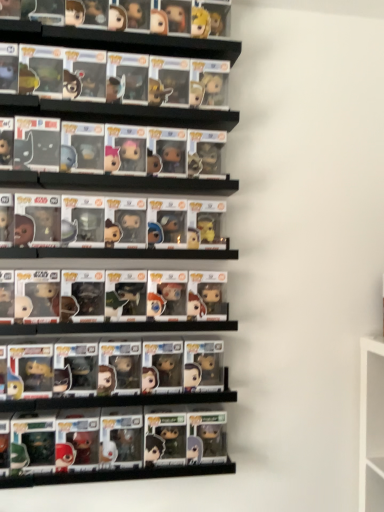
Question: Should I look upward or downward to see shiny plastic figures at lower center?

Choices:
 (A) up
 (B) down

Answer: (B)